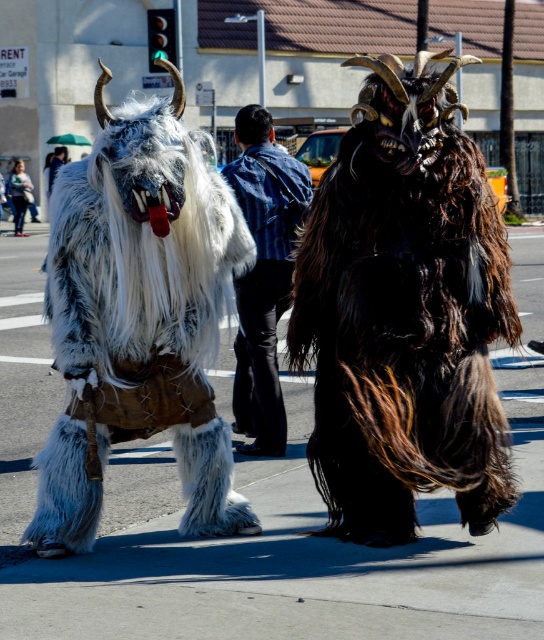
You are a photographer trying to capture both the shaggy fur costume at center and the denim jacket at center in a single frame. Which costume should you focus on first to ensure it fits properly in the photo?

The shaggy fur costume at center is bigger than the denim jacket at center, so you should focus on positioning the shaggy fur costume at center first to ensure it fits within the frame.

You are a photographer positioned at the back of the street. You want to take a photo of both the shaggy fur costume at center and the white furry bull at center. Which one will appear larger in your photo?

The shaggy fur costume at center will appear larger in the photo because it is closer to the viewer than the white furry bull at center.

You are a photographer trying to capture both the shaggy fur costume at center and the denim jacket at center in a single frame. Based on their positions, which one is closer to the camera?

The shaggy fur costume at center is positioned under the denim jacket at center, meaning it is closer to the camera.